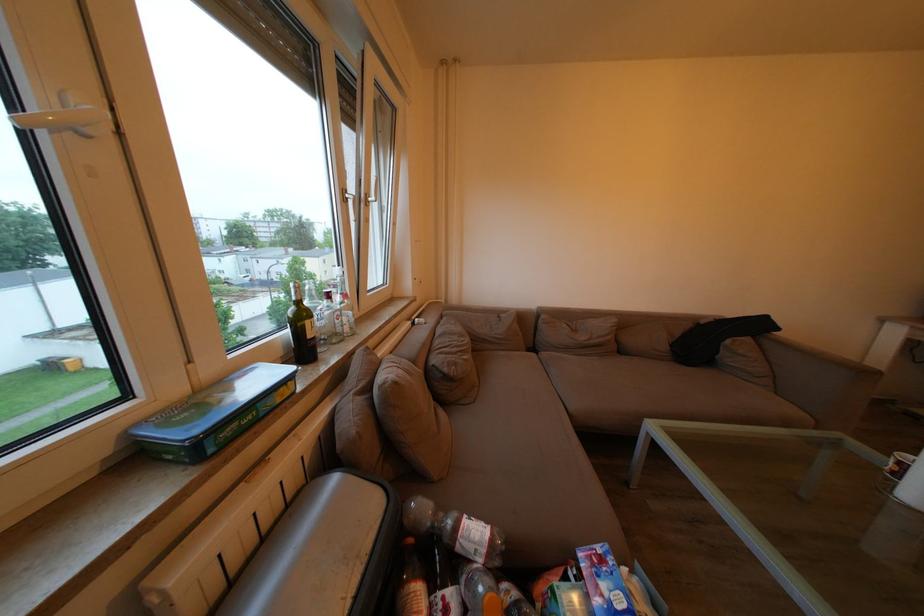
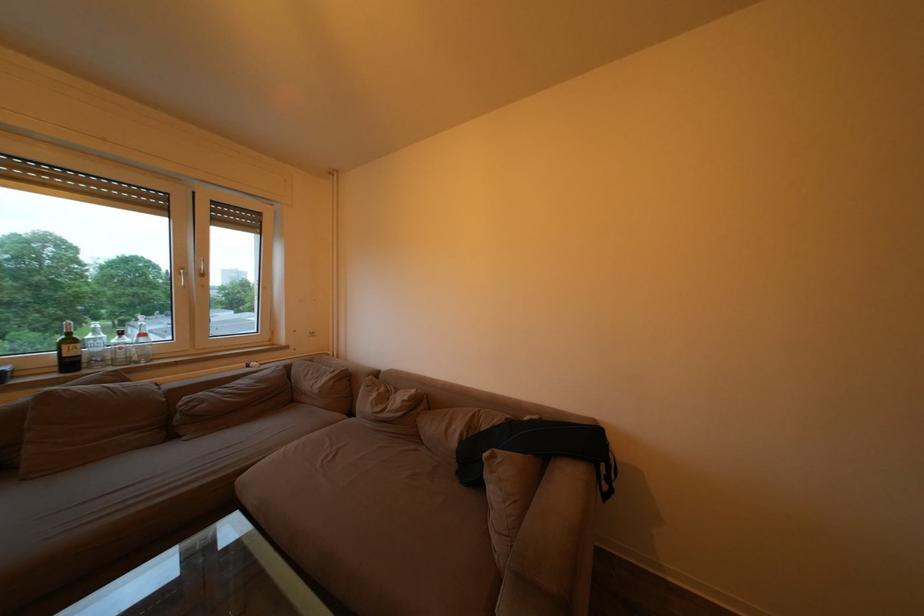
Question: The images are taken continuously from a first-person perspective. In which direction are you moving?

Choices:
 (A) Left
 (B) Right
 (C) Forward
 (D) Backward

Answer: (B)